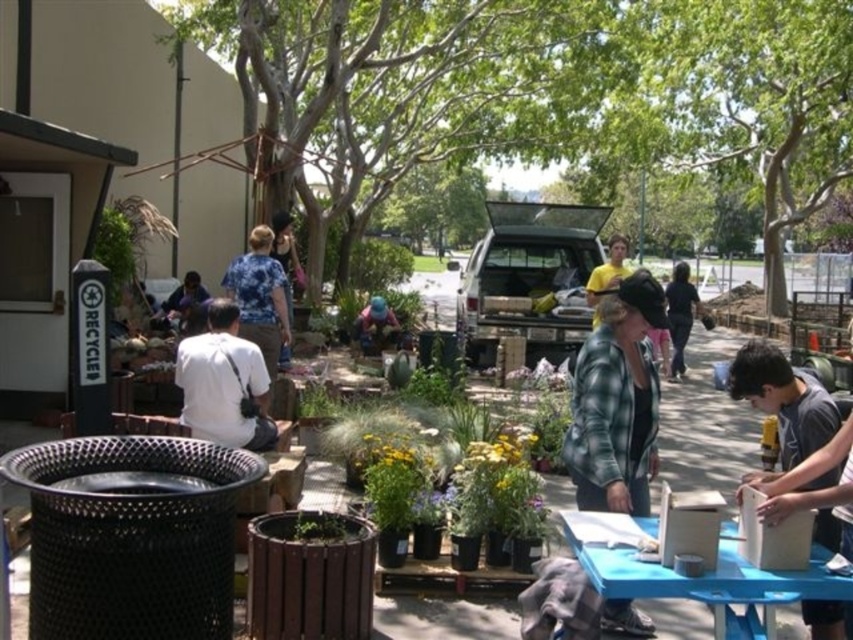
Question: Is gray cotton shirt at lower right thinner than matte blue shirt at center?

Choices:
 (A) no
 (B) yes

Answer: (B)

Question: Which object is positioned closest to the blue denim jeans at center?

Choices:
 (A) gray cotton shirt at lower right
 (B) black fabric at center
 (C) blue tie-dye shirt at center
 (D) green plaid jacket at center

Answer: (B)

Question: Observing the image, what is the correct spatial positioning of gray cotton shirt at lower right in reference to blue denim jeans at center?

Choices:
 (A) left
 (B) right

Answer: (B)

Question: Which object is the farthest from the blue tie-dye shirt at center?

Choices:
 (A) blue denim jeans at center
 (B) gray cotton shirt at lower right
 (C) matte blue shirt at center
 (D) green plaid jacket at center

Answer: (A)

Question: Estimate the real-world distances between objects in this image. Which object is closer to the blue tie-dye shirt at center?

Choices:
 (A) blue denim jeans at center
 (B) gray cotton shirt at lower right
 (C) matte blue shirt at center
 (D) yellow cotton shirt at center

Answer: (D)

Question: Is white matte shirt at center below matte blue shirt at center?

Choices:
 (A) no
 (B) yes

Answer: (B)